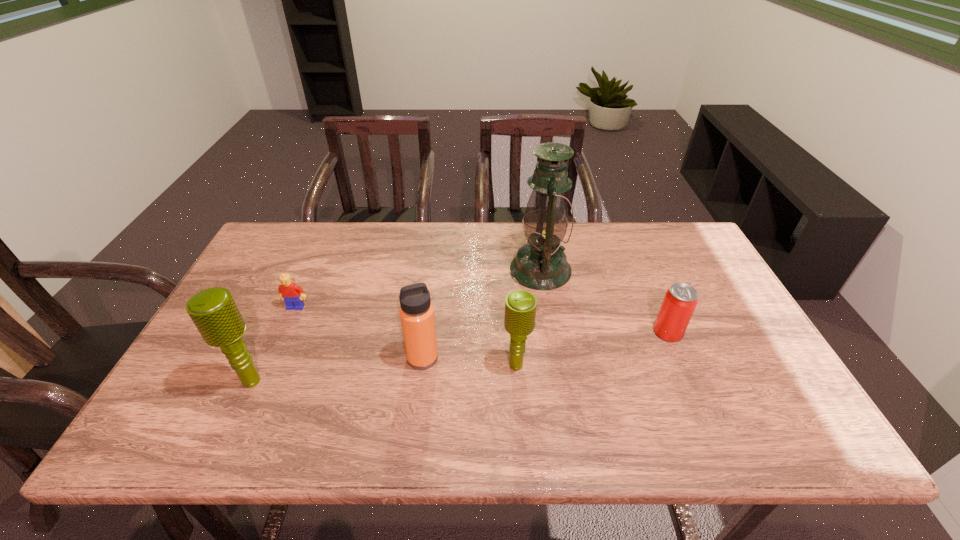
In order to click on the left microphone in this screenshot , I will do `click(214, 312)`.

You are a GUI agent. You are given a task and a screenshot of the screen. Output one action in this format:
    pyautogui.click(x=<x>, y=<y>)
    Task: Click on the shorter microphone
    
    Given the screenshot: What is the action you would take?
    pyautogui.click(x=520, y=306)

Find the location of a particular element. This screenshot has height=540, width=960. the second farthest object is located at coordinates (293, 296).

Where is `the shortest object`? Image resolution: width=960 pixels, height=540 pixels. the shortest object is located at coordinates (293, 296).

Find the location of a particular element. This screenshot has height=540, width=960. the third farthest object is located at coordinates (680, 300).

The height and width of the screenshot is (540, 960). I want to click on can, so click(x=680, y=300).

I want to click on oil lamp, so click(541, 264).

Find the location of a particular element. This screenshot has height=540, width=960. the tallest object is located at coordinates (541, 264).

The image size is (960, 540). Identify the location of thermos bottle. (416, 311).

Where is `free region located 0.150m on the back of the left microphone`? free region located 0.150m on the back of the left microphone is located at coordinates (280, 321).